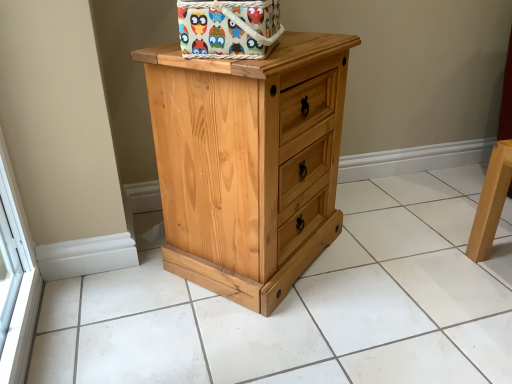
Question: From the image's perspective, is natural wood cabinet at center located above multicolored fabric basket at top center?

Choices:
 (A) yes
 (B) no

Answer: (B)

Question: Considering the relative sizes of natural wood cabinet at center and multicolored fabric basket at top center in the image provided, is natural wood cabinet at center smaller than multicolored fabric basket at top center?

Choices:
 (A) yes
 (B) no

Answer: (B)

Question: Is natural wood cabinet at center turned away from multicolored fabric basket at top center?

Choices:
 (A) no
 (B) yes

Answer: (A)

Question: Would you say multicolored fabric basket at top center is part of natural wood cabinet at center's contents?

Choices:
 (A) no
 (B) yes

Answer: (A)

Question: Is natural wood cabinet at center further to camera compared to multicolored fabric basket at top center?

Choices:
 (A) yes
 (B) no

Answer: (B)

Question: Would you say natural wood cabinet at center is inside or outside multicolored fabric basket at top center?

Choices:
 (A) outside
 (B) inside

Answer: (A)

Question: In terms of height, does natural wood cabinet at center look taller or shorter compared to multicolored fabric basket at top center?

Choices:
 (A) tall
 (B) short

Answer: (B)

Question: In the image, is natural wood cabinet at center positioned in front of or behind multicolored fabric basket at top center?

Choices:
 (A) front
 (B) behind

Answer: (A)

Question: From the image's perspective, is natural wood cabinet at center positioned above or below multicolored fabric basket at top center?

Choices:
 (A) below
 (B) above

Answer: (A)

Question: Is multicolored fabric basket at top center bigger or smaller than natural wood chest of drawers at center?

Choices:
 (A) big
 (B) small

Answer: (B)

Question: From the image's perspective, is multicolored fabric basket at top center positioned above or below natural wood chest of drawers at center?

Choices:
 (A) below
 (B) above

Answer: (B)

Question: From their relative heights in the image, would you say multicolored fabric basket at top center is taller or shorter than natural wood chest of drawers at center?

Choices:
 (A) tall
 (B) short

Answer: (B)

Question: Which is correct: multicolored fabric basket at top center is inside natural wood chest of drawers at center, or outside of it?

Choices:
 (A) outside
 (B) inside

Answer: (A)

Question: Is natural wood chest of drawers at center spatially inside multicolored fabric basket at top center, or outside of it?

Choices:
 (A) outside
 (B) inside

Answer: (A)

Question: Is natural wood chest of drawers at center in front of or behind multicolored fabric basket at top center in the image?

Choices:
 (A) behind
 (B) front

Answer: (A)